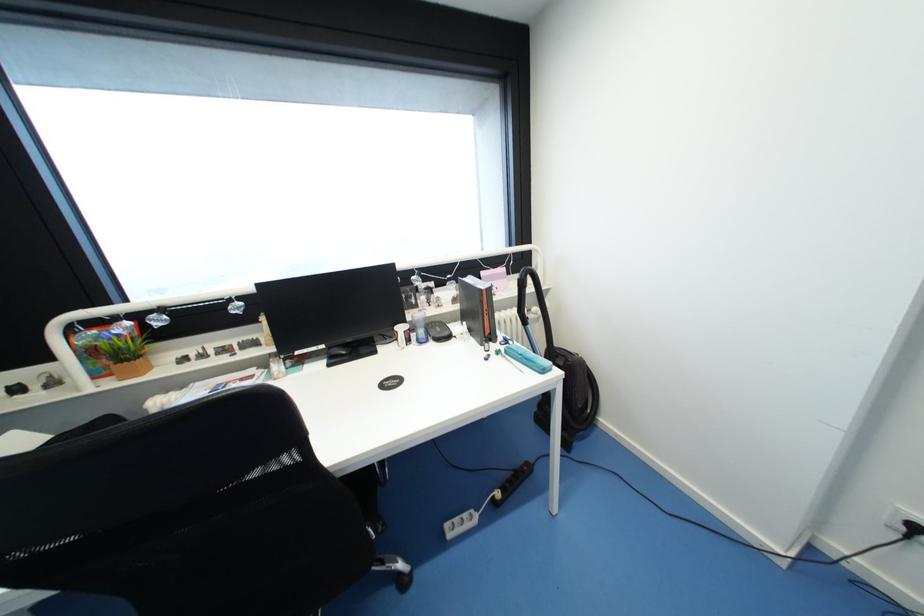
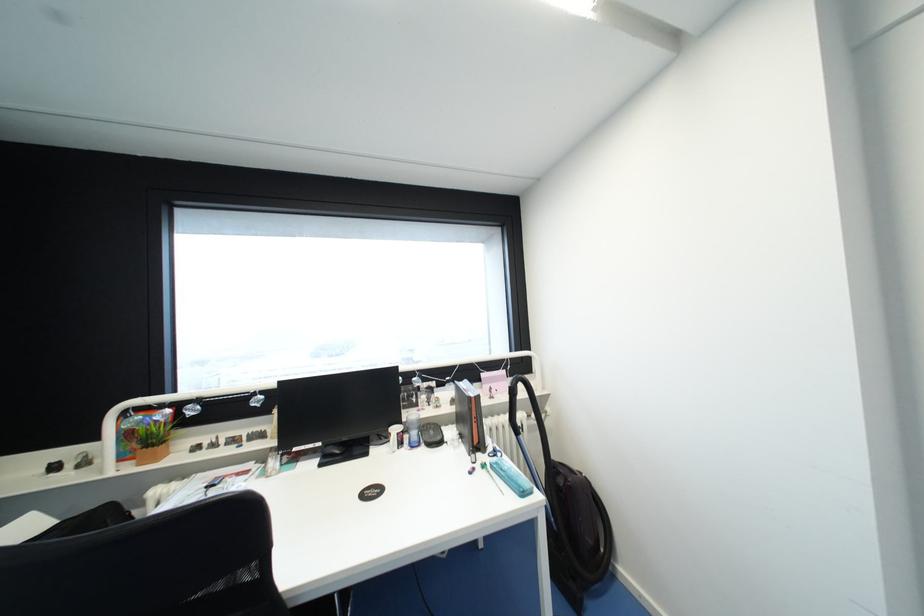
In the second image, find the point that corresponds to (x=488, y=274) in the first image.

(488, 376)